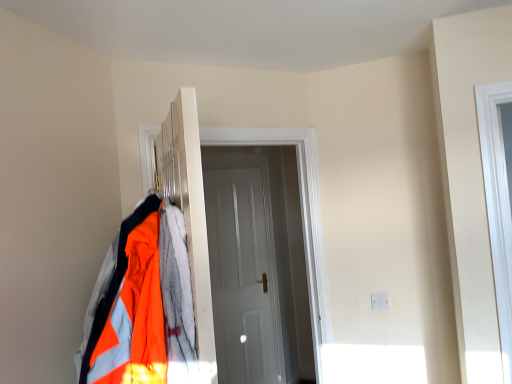
Question: Should I look upward or downward to see white glossy door at center, the first door in the front-to-back sequence?

Choices:
 (A) up
 (B) down

Answer: (B)

Question: Does white matte door at center, marked as the first door in a back-to-front arrangement, lie behind white glossy door at center, the first door in the front-to-back sequence?

Choices:
 (A) no
 (B) yes

Answer: (B)

Question: Is white matte door at center, which is counted as the second door, starting from the front, smaller than white glossy door at center, the first door in the front-to-back sequence?

Choices:
 (A) no
 (B) yes

Answer: (B)

Question: Could you tell me if white matte door at center, which is counted as the second door, starting from the front, is facing white glossy door at center, positioned as the second door in back-to-front order?

Choices:
 (A) yes
 (B) no

Answer: (A)

Question: From a real-world perspective, is white matte door at center, marked as the first door in a back-to-front arrangement, positioned over white glossy door at center, the first door in the front-to-back sequence, based on gravity?

Choices:
 (A) no
 (B) yes

Answer: (A)

Question: Can we say white matte door at center, which is counted as the second door, starting from the front, lies outside white glossy door at center, the first door in the front-to-back sequence?

Choices:
 (A) yes
 (B) no

Answer: (A)

Question: Is white matte door at center, marked as the first door in a back-to-front arrangement, surrounding white glossy door at center, the first door in the front-to-back sequence?

Choices:
 (A) yes
 (B) no

Answer: (B)

Question: Is white matte door at center, marked as the first door in a back-to-front arrangement, completely or partially inside metallic silver coat rack at center?

Choices:
 (A) yes
 (B) no

Answer: (B)

Question: Considering the relative positions of metallic silver coat rack at center and white matte door at center, which is counted as the second door, starting from the front, in the image provided, is metallic silver coat rack at center to the right of white matte door at center, which is counted as the second door, starting from the front, from the viewer's perspective?

Choices:
 (A) no
 (B) yes

Answer: (A)

Question: Is metallic silver coat rack at center further to the viewer compared to white matte door at center, which is counted as the second door, starting from the front?

Choices:
 (A) yes
 (B) no

Answer: (B)

Question: Does metallic silver coat rack at center have a smaller size compared to white matte door at center, marked as the first door in a back-to-front arrangement?

Choices:
 (A) no
 (B) yes

Answer: (A)

Question: Is there a large distance between metallic silver coat rack at center and white matte door at center, marked as the first door in a back-to-front arrangement?

Choices:
 (A) yes
 (B) no

Answer: (A)

Question: Is metallic silver coat rack at center beside white matte door at center, which is counted as the second door, starting from the front?

Choices:
 (A) yes
 (B) no

Answer: (B)

Question: Is white glossy door at center, the first door in the front-to-back sequence, at the back of metallic silver coat rack at center?

Choices:
 (A) yes
 (B) no

Answer: (B)